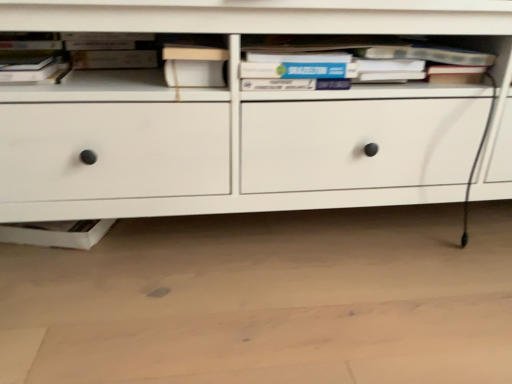
Question: Is matte black book at upper left positioned beyond the bounds of hardcover book at center, marked as the 2th book in a left-to-right arrangement?

Choices:
 (A) yes
 (B) no

Answer: (A)

Question: Is matte black book at upper left positioned far away from hardcover book at center, marked as the 2th book in a left-to-right arrangement?

Choices:
 (A) yes
 (B) no

Answer: (B)

Question: From a real-world perspective, is matte black book at upper left under hardcover book at center, which ranks as the 1th book in right-to-left order?

Choices:
 (A) yes
 (B) no

Answer: (A)

Question: Could you tell me if matte black book at upper left is facing hardcover book at center, marked as the 2th book in a left-to-right arrangement?

Choices:
 (A) yes
 (B) no

Answer: (B)

Question: Does matte black book at upper left have a larger size compared to hardcover book at center, marked as the 2th book in a left-to-right arrangement?

Choices:
 (A) yes
 (B) no

Answer: (B)

Question: Is hardcover book at center, which ranks as the 1th book in right-to-left order, a part of matte black book at upper left?

Choices:
 (A) no
 (B) yes

Answer: (A)

Question: From a real-world perspective, is hardcover book at upper left, which is the first book in left-to-right order, physically above hardcover book at center, which ranks as the 1th book in right-to-left order?

Choices:
 (A) no
 (B) yes

Answer: (A)

Question: Does hardcover book at upper left, which is the first book in left-to-right order, have a lesser height compared to hardcover book at center, marked as the 2th book in a left-to-right arrangement?

Choices:
 (A) no
 (B) yes

Answer: (B)

Question: Can you confirm if hardcover book at upper left, the 2th book in the right-to-left sequence, is thinner than hardcover book at center, which ranks as the 1th book in right-to-left order?

Choices:
 (A) no
 (B) yes

Answer: (B)

Question: Is hardcover book at upper left, which is the first book in left-to-right order, positioned with its back to hardcover book at center, marked as the 2th book in a left-to-right arrangement?

Choices:
 (A) no
 (B) yes

Answer: (A)

Question: Is hardcover book at upper left, which is the first book in left-to-right order, to the right of hardcover book at center, marked as the 2th book in a left-to-right arrangement, from the viewer's perspective?

Choices:
 (A) yes
 (B) no

Answer: (B)

Question: Could you tell me if hardcover book at upper left, which is the first book in left-to-right order, is turned towards hardcover book at center, marked as the 2th book in a left-to-right arrangement?

Choices:
 (A) yes
 (B) no

Answer: (B)

Question: Is the depth of hardcover book at upper left, which is the first book in left-to-right order, less than that of white matte chest of drawers at center?

Choices:
 (A) no
 (B) yes

Answer: (A)